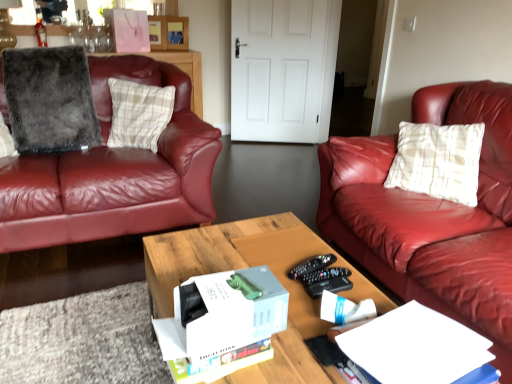
Locate an element on the screen. The width and height of the screenshot is (512, 384). vacant space that is to the left of black plastic remote control at center is located at coordinates (264, 263).